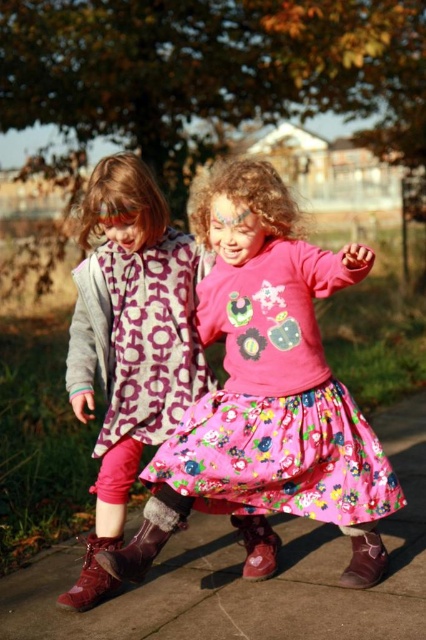
Question: Which object appears farthest from the camera in this image?

Choices:
 (A) floral cotton dress at center
 (B) pink fabric skirt at lower center

Answer: (A)

Question: Is shiny brown boot at lower left below brown suede boot at lower center?

Choices:
 (A) yes
 (B) no

Answer: (A)

Question: Can you confirm if floral cotton dress at center is smaller than brown suede boot at lower center?

Choices:
 (A) no
 (B) yes

Answer: (A)

Question: From the image, what is the correct spatial relationship of brown suede boot at lower left in relation to brown leather boot at lower right?

Choices:
 (A) above
 (B) below

Answer: (A)

Question: Which of the following is the farthest from the observer?

Choices:
 (A) pink fabric skirt at lower center
 (B) pink floral dress at center

Answer: (B)

Question: Among these points, which one is farthest from the camera?

Choices:
 (A) (241, 532)
 (B) (328, 390)

Answer: (A)